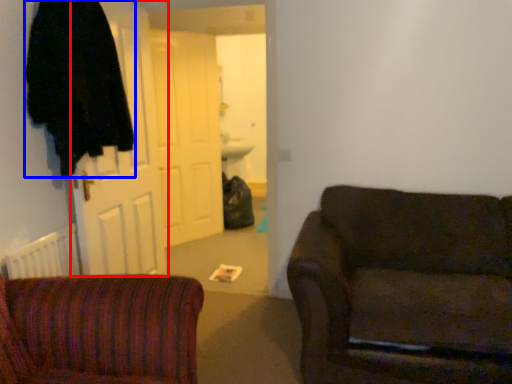
Question: Which of the following is the closest to the observer, door (highlighted by a red box) or robe (highlighted by a blue box)?

Choices:
 (A) door
 (B) robe

Answer: (B)